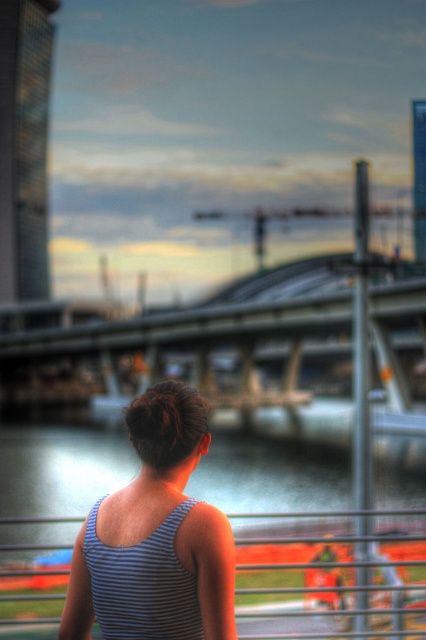
Between smooth water at lower center and striped fabric tank top at center, which one appears on the right side from the viewer's perspective?

From the viewer's perspective, smooth water at lower center appears more on the right side.

Can you confirm if smooth water at lower center is positioned below striped fabric tank top at center?

Correct, smooth water at lower center is located below striped fabric tank top at center.

Who is more forward, [278,477] or [232,636]?

Positioned in front is point [232,636].

Locate an element on the screen. The width and height of the screenshot is (426, 640). smooth water at lower center is located at coordinates (60, 468).

Which is more to the right, striped fabric tank top at center or metallic silver rail at center?

From the viewer's perspective, striped fabric tank top at center appears more on the right side.

Can you confirm if striped fabric tank top at center is bigger than metallic silver rail at center?

No, striped fabric tank top at center is not bigger than metallic silver rail at center.

Is point (131, 403) positioned behind point (25, 588)?

No, (131, 403) is in front of (25, 588).

Find the location of a particular element. The image size is (426, 640). striped fabric tank top at center is located at coordinates (158, 520).

This screenshot has height=640, width=426. What do you see at coordinates (178, 355) in the screenshot? I see `concrete bridge at center` at bounding box center [178, 355].

Who is shorter, concrete bridge at center or striped fabric tank top at center?

striped fabric tank top at center is shorter.

Does point (288, 406) come in front of point (108, 529)?

No, (288, 406) is behind (108, 529).

In order to click on concrete bridge at center in this screenshot , I will do `click(178, 355)`.